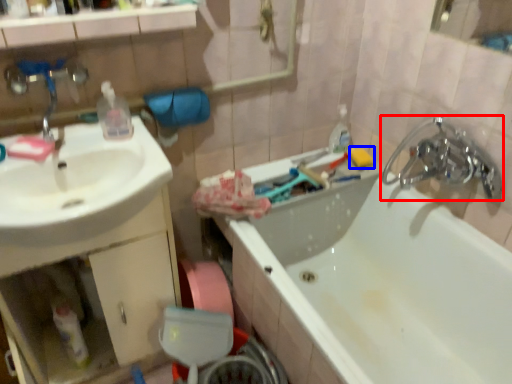
Question: Which of the following is the closest to the observer, tap (highlighted by a red box) or soap (highlighted by a blue box)?

Choices:
 (A) tap
 (B) soap

Answer: (A)